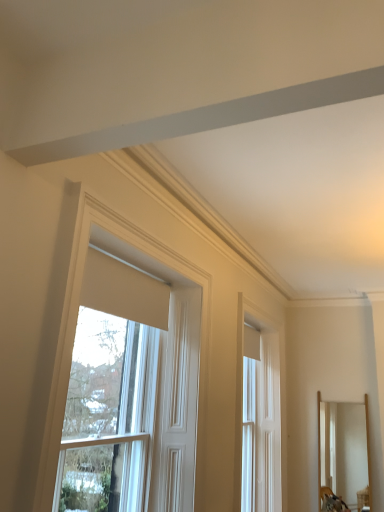
Question: Is white matte window at upper center, positioned as the first window in front-to-back order, positioned beyond the bounds of wooden mirror at right?

Choices:
 (A) yes
 (B) no

Answer: (A)

Question: Is white matte window at upper center, positioned as the first window in front-to-back order, bigger than wooden mirror at right?

Choices:
 (A) no
 (B) yes

Answer: (B)

Question: From the image's perspective, is white matte window at upper center, the second window positioned from the right, on top of wooden mirror at right?

Choices:
 (A) yes
 (B) no

Answer: (A)

Question: Considering the relative sizes of white matte window at upper center, positioned as the first window in front-to-back order, and wooden mirror at right in the image provided, is white matte window at upper center, positioned as the first window in front-to-back order, thinner than wooden mirror at right?

Choices:
 (A) no
 (B) yes

Answer: (B)

Question: Does white matte window at upper center, placed as the 2th window when sorted from back to front, appear on the right side of wooden mirror at right?

Choices:
 (A) no
 (B) yes

Answer: (A)

Question: Is wooden mirror at right inside or outside of white matte window at upper center, positioned as the first window in front-to-back order?

Choices:
 (A) outside
 (B) inside

Answer: (A)

Question: In terms of size, does wooden mirror at right appear bigger or smaller than white matte window at upper center, arranged as the first window when viewed from the left?

Choices:
 (A) small
 (B) big

Answer: (A)

Question: From a real-world perspective, is wooden mirror at right above or below white matte window at upper center, the second window positioned from the right?

Choices:
 (A) below
 (B) above

Answer: (A)

Question: Considering the positions of point (360, 455) and point (142, 437), is point (360, 455) closer or farther from the camera than point (142, 437)?

Choices:
 (A) farther
 (B) closer

Answer: (A)

Question: Considering their positions, is white glossy door at center, which ranks as the 2th window in front-to-back order, located in front of or behind white matte window at upper center, arranged as the first window when viewed from the left?

Choices:
 (A) front
 (B) behind

Answer: (B)

Question: Considering the positions of point (271, 456) and point (127, 357), is point (271, 456) closer or farther from the camera than point (127, 357)?

Choices:
 (A) closer
 (B) farther

Answer: (B)

Question: From the image's perspective, is white glossy door at center, which is the first window from back to front, positioned above or below white matte window at upper center, the second window positioned from the right?

Choices:
 (A) above
 (B) below

Answer: (B)

Question: Considering the positions of white glossy door at center, which ranks as the 2th window in front-to-back order, and white matte window at upper center, arranged as the first window when viewed from the left, in the image, is white glossy door at center, which ranks as the 2th window in front-to-back order, bigger or smaller than white matte window at upper center, arranged as the first window when viewed from the left,?

Choices:
 (A) big
 (B) small

Answer: (B)

Question: Is wooden mirror at right taller or shorter than white glossy door at center, which ranks as the 2th window in front-to-back order?

Choices:
 (A) tall
 (B) short

Answer: (B)

Question: Is point (354, 501) positioned closer to the camera than point (268, 369)?

Choices:
 (A) closer
 (B) farther

Answer: (B)